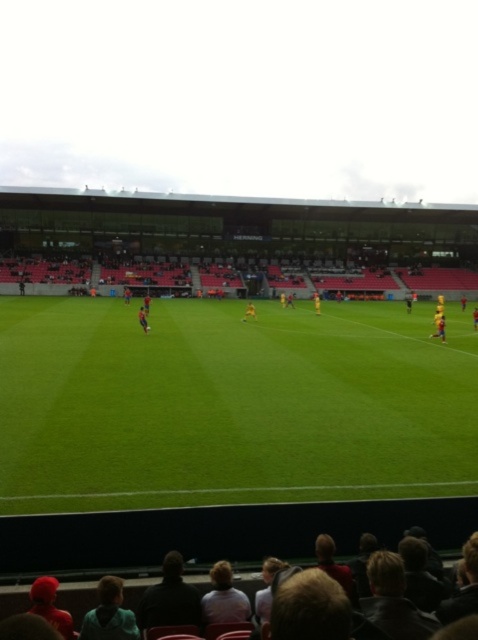
You are a photographer trying to capture a wide shot of the soccer match. You notice the red knit cap at lower left and the blonde hair at lower center in your frame. Which object should you adjust your focus to ensure both are visible without cropping? Explain your reasoning based on their sizes.

The red knit cap at lower left is wider than the blonde hair at lower center. To ensure both are visible without cropping, focus on the larger object, the red knit cap at lower left, as it requires more space in the frame.

You are a drone operator trying to capture aerial footage of the soccer match. The stadium has a restricted airspace zone that starts at point 0.6 and 0.48. Can you fly your drone over the green grass football field at center without entering the restricted zone?

The green grass football field at center is located at point (229, 404). Since the restricted zone starts at 0.6 and 0.48, the field is slightly beyond the restricted zone. Therefore, you can fly the drone over the green grass football field at center without entering the restricted airspace.